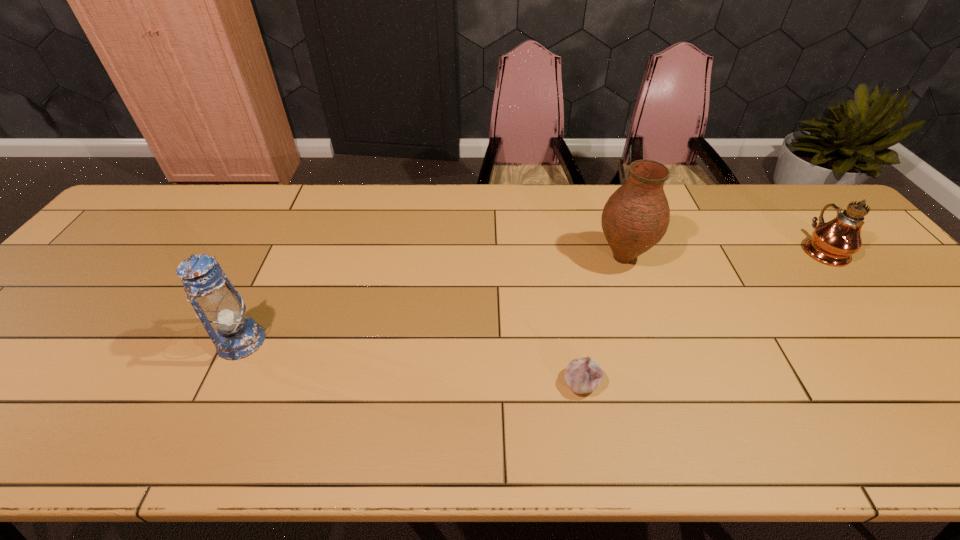
This screenshot has height=540, width=960. In order to click on oil lamp in this screenshot , I will do coord(833,243).

Image resolution: width=960 pixels, height=540 pixels. What are the coordinates of `vase` in the screenshot? It's located at (636, 216).

Where is `the third farthest object`? This screenshot has width=960, height=540. the third farthest object is located at coordinates (219, 307).

You are a GUI agent. You are given a task and a screenshot of the screen. Output one action in this format:
    pyautogui.click(x=<x>, y=<y>)
    Task: Click on the lantern
    
    Given the screenshot: What is the action you would take?
    pyautogui.click(x=219, y=307)

Where is `the nearest object`? This screenshot has height=540, width=960. the nearest object is located at coordinates (583, 375).

The image size is (960, 540). I want to click on the shortest object, so click(583, 375).

Locate an element on the screen. vacant point located on the left of the oil lamp is located at coordinates (782, 248).

The height and width of the screenshot is (540, 960). Identify the location of vacant space situated on the back of the third object from left to right. (599, 185).

Image resolution: width=960 pixels, height=540 pixels. I want to click on free space located 0.140m on the front-facing side of the leftmost object, so click(324, 341).

You are a GUI agent. You are given a task and a screenshot of the screen. Output one action in this format:
    pyautogui.click(x=<x>, y=<y>)
    Task: Click on the vacant area situated 0.330m on the back of the garlic
    The height and width of the screenshot is (540, 960).
    Given the screenshot: What is the action you would take?
    pyautogui.click(x=560, y=265)